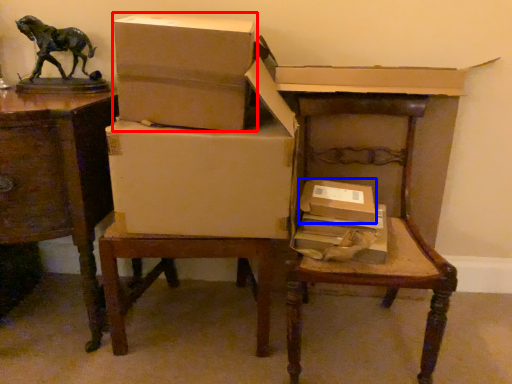
Question: Among these objects, which one is nearest to the camera, box (highlighted by a red box) or box (highlighted by a blue box)?

Choices:
 (A) box
 (B) box

Answer: (A)